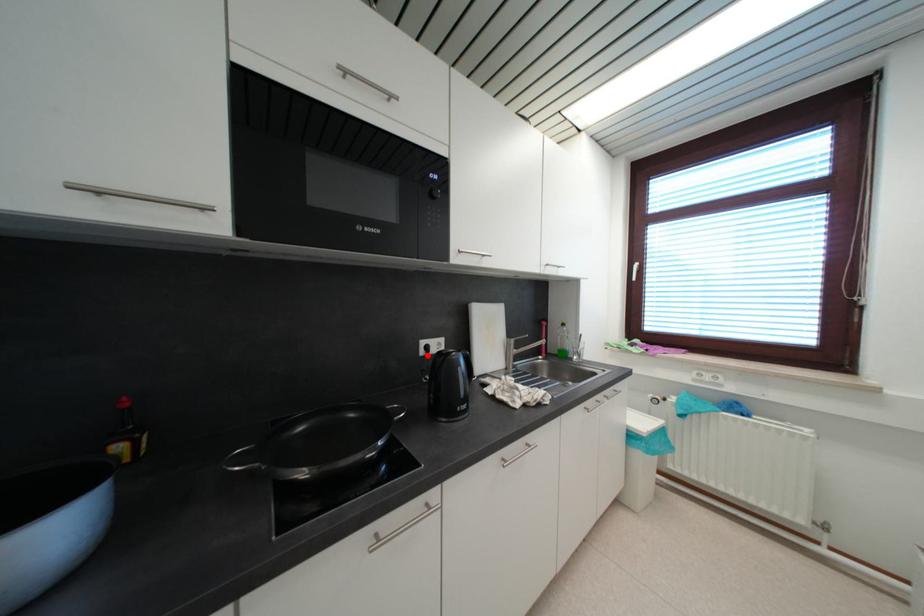
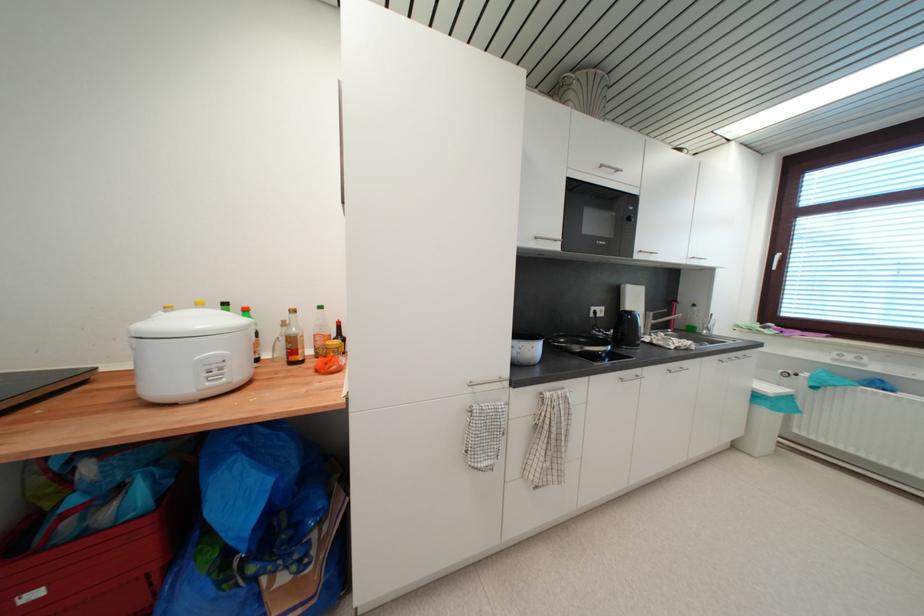
Locate, in the second image, the point that corresponds to the highlighted location in the first image.

(597, 317)